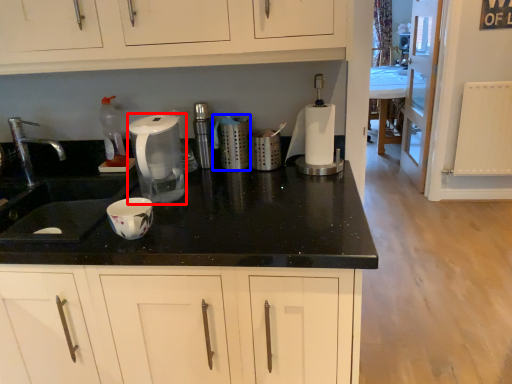
Question: Which object is further to the camera taking this photo, home appliance (highlighted by a red box) or kitchen appliance (highlighted by a blue box)?

Choices:
 (A) home appliance
 (B) kitchen appliance

Answer: (B)